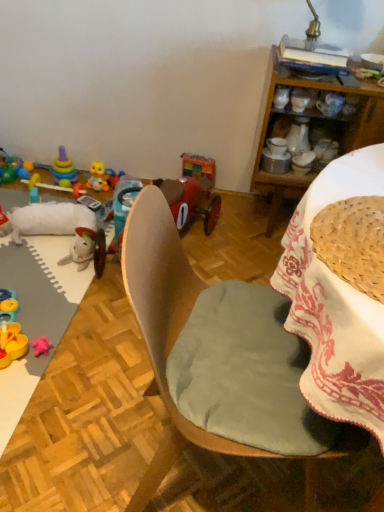
Image resolution: width=384 pixels, height=512 pixels. I want to click on free location above translucent plastic toy at left, which is counted as the 1th toy, starting from the left (from a real-world perspective), so click(x=6, y=165).